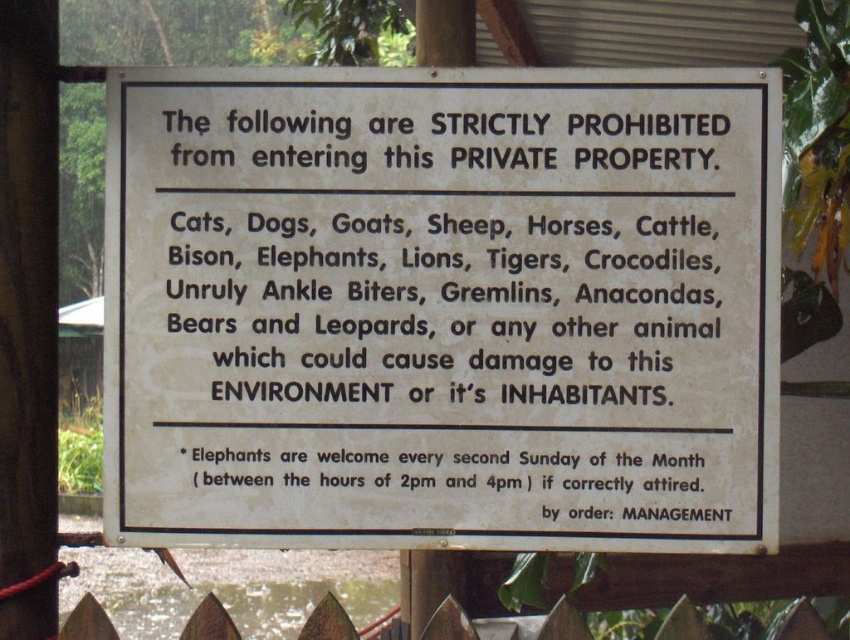
Can you confirm if white paper sign at center is thinner than wooden picket fence at lower center?

Yes, white paper sign at center is thinner than wooden picket fence at lower center.

Can you confirm if white paper sign at center is smaller than wooden picket fence at lower center?

No, white paper sign at center is not smaller than wooden picket fence at lower center.

Describe the element at coordinates (442, 308) in the screenshot. I see `white paper sign at center` at that location.

Locate an element on the screen. The image size is (850, 640). white paper sign at center is located at coordinates (442, 308).